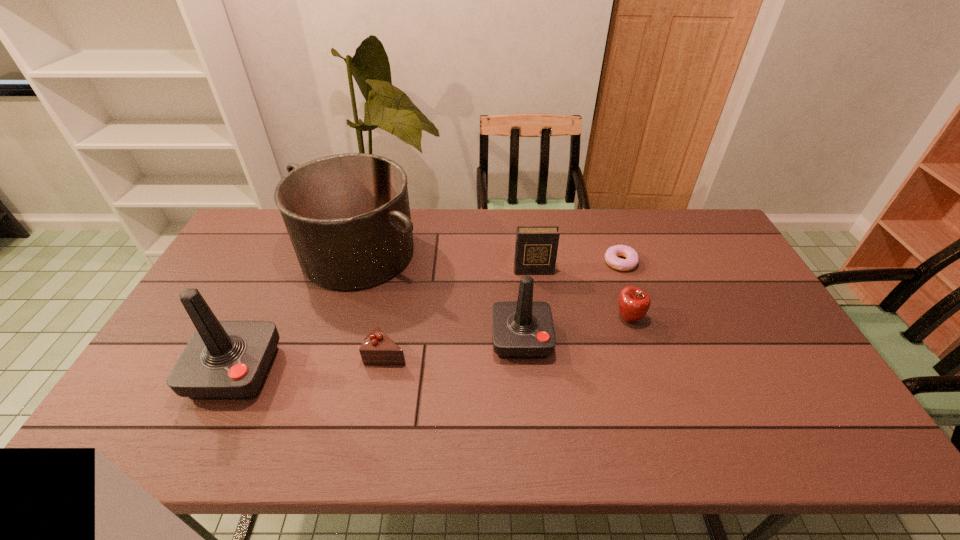
Locate an element on the screen. The height and width of the screenshot is (540, 960). empty space between the second shortest object and the pan is located at coordinates (372, 303).

Identify which object is the fourth nearest to the right joystick. Please provide its 2D coordinates. Your answer should be formatted as a tuple, i.e. [(x, y)], where the tuple contains the x and y coordinates of a point satisfying the conditions above.

[(348, 217)]

Identify which object is located as the sixth nearest to the pan. Please provide its 2D coordinates. Your answer should be formatted as a tuple, i.e. [(x, y)], where the tuple contains the x and y coordinates of a point satisfying the conditions above.

[(632, 259)]

The image size is (960, 540). Find the location of `free location that satisfies the following two spatial constraints: 1. on the back side of the apple; 2. on the left side of the fifth shortest object`. free location that satisfies the following two spatial constraints: 1. on the back side of the apple; 2. on the left side of the fifth shortest object is located at coordinates (519, 318).

Find the location of a particular element. The image size is (960, 540). free spot that satisfies the following two spatial constraints: 1. on the front side of the shortest object; 2. on the left side of the pan is located at coordinates (355, 262).

Where is `blank space that satisfies the following two spatial constraints: 1. on the front cover of the apple; 2. on the left side of the fourth tallest object`? blank space that satisfies the following two spatial constraints: 1. on the front cover of the apple; 2. on the left side of the fourth tallest object is located at coordinates (540, 318).

What are the coordinates of `vacant space that satisfies the following two spatial constraints: 1. on the front side of the apple; 2. on the right side of the pan` in the screenshot? It's located at (338, 318).